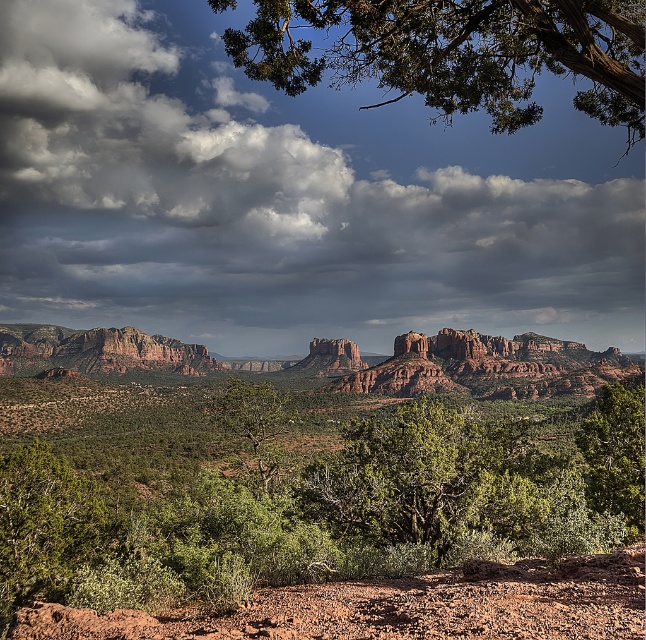
Question: Is cloudy sky at upper center bigger than green leafy tree at center?

Choices:
 (A) no
 (B) yes

Answer: (B)

Question: Which of the following is the closest to the observer?

Choices:
 (A) (253, 48)
 (B) (640, 484)
 (C) (245, 467)
 (D) (21, 385)

Answer: (A)

Question: Is green leafy tree at upper center to the left of rustic sandstone mountain at left from the viewer's perspective?

Choices:
 (A) no
 (B) yes

Answer: (A)

Question: Considering the relative positions of green leafy tree at upper center and green leafy tree at center in the image provided, where is green leafy tree at upper center located with respect to green leafy tree at center?

Choices:
 (A) below
 (B) above

Answer: (B)

Question: Which object is positioned farthest from the cloudy sky at upper center?

Choices:
 (A) green leafy tree at right
 (B) green leafy tree at upper center
 (C) green leafy shrubs at center
 (D) green leafy tree at center

Answer: (A)

Question: Which of the following is the farthest from the observer?

Choices:
 (A) cloudy sky at upper center
 (B) rustic sandstone mountain at left
 (C) green leafy tree at right
 (D) green leafy shrubs at center

Answer: (A)